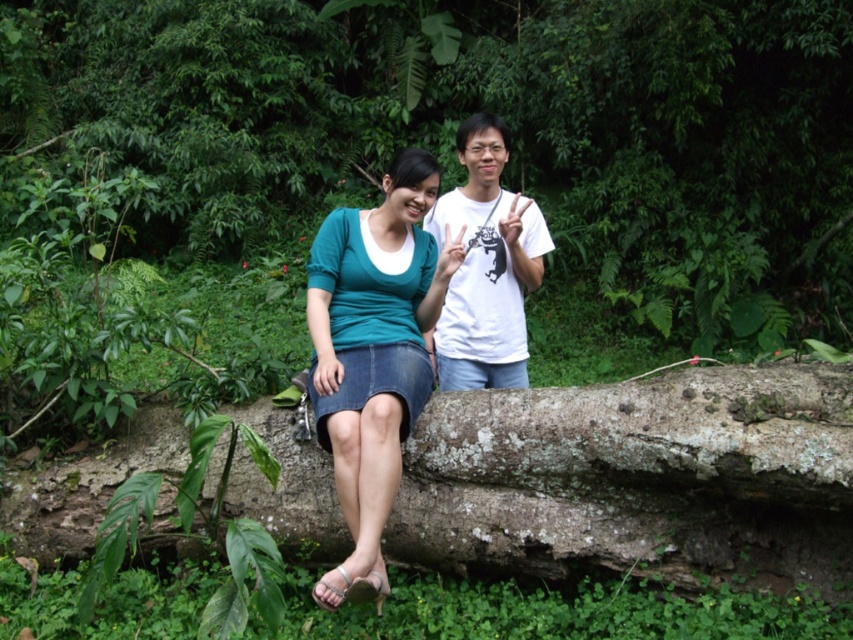
Question: Which of the following is the farthest from the observer?

Choices:
 (A) (347, 433)
 (B) (277, 436)
 (C) (460, 337)

Answer: (C)

Question: Can you confirm if rough bark log at center is smaller than denim skirt at center?

Choices:
 (A) no
 (B) yes

Answer: (A)

Question: Which point is closer to the camera taking this photo?

Choices:
 (A) (784, 484)
 (B) (416, 296)
 (C) (497, 314)

Answer: (A)

Question: Which point is closer to the camera?

Choices:
 (A) (432, 227)
 (B) (376, 540)
 (C) (703, 548)

Answer: (B)

Question: Can you confirm if denim skirt at center is positioned to the right of white matte t-shirt at center?

Choices:
 (A) no
 (B) yes

Answer: (A)

Question: Observing the image, what is the correct spatial positioning of denim skirt at center in reference to white matte t-shirt at center?

Choices:
 (A) right
 (B) left

Answer: (B)